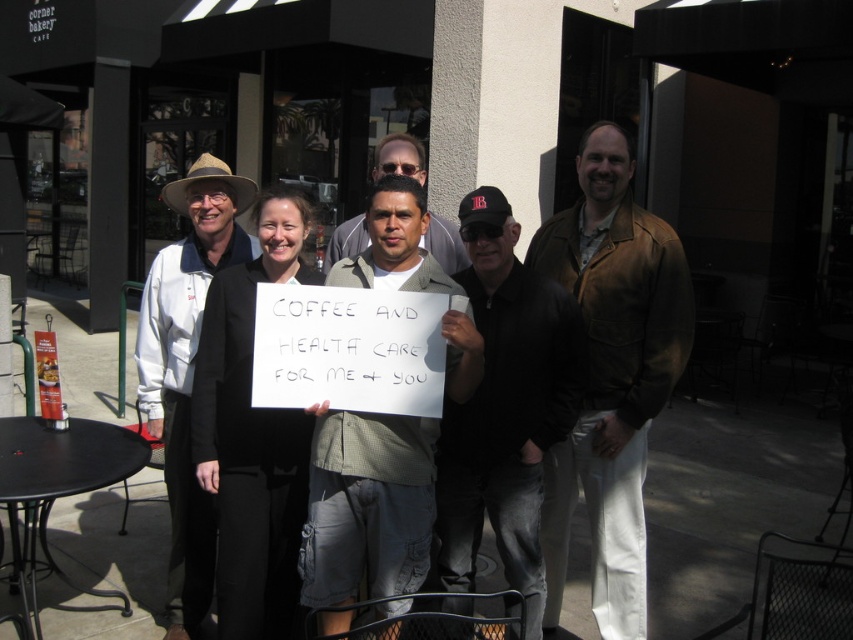
Question: Among these objects, which one is nearest to the camera?

Choices:
 (A) light brown textured shirt at center
 (B) light brown cargo shorts at center

Answer: (B)

Question: Considering the real-world distances, which object is farthest from the light brown textured shirt at center?

Choices:
 (A) brown leather jacket at center
 (B) black leather jacket at center
 (C) light brown cargo shorts at center

Answer: (A)

Question: Which is nearer to the light brown cargo shorts at center?

Choices:
 (A) brown leather jacket at center
 (B) light brown textured shirt at center
 (C) matte white coat at left
 (D) black leather jacket at center

Answer: (D)

Question: Is black leather jacket at center thinner than matte white coat at left?

Choices:
 (A) yes
 (B) no

Answer: (A)

Question: Can you confirm if black fabric sign at center is wider than light brown textured shirt at center?

Choices:
 (A) yes
 (B) no

Answer: (B)

Question: Is matte white coat at left below light brown textured shirt at center?

Choices:
 (A) no
 (B) yes

Answer: (B)